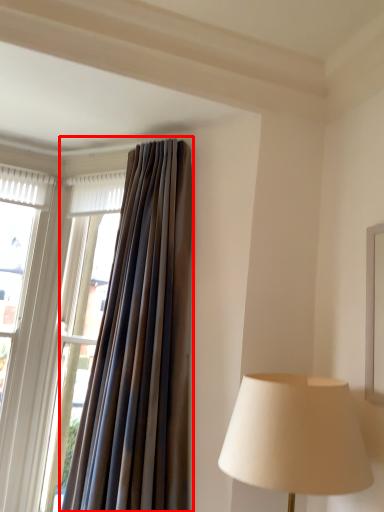
Question: From the image, what is the correct spatial relationship of curtain (annotated by the red box) in relation to window?

Choices:
 (A) left
 (B) right

Answer: (B)